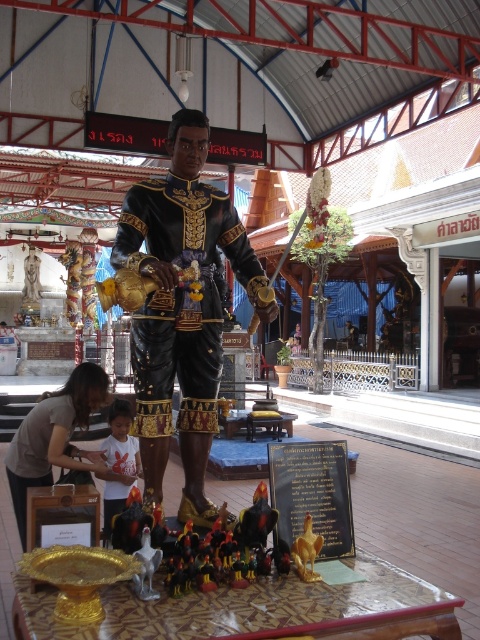
Who is more forward, (99, 465) or (107, 520)?

Point (107, 520)

Who is positioned more to the right, brown fabric shirt at lower left or white cotton shirt at center?

white cotton shirt at center

What are the coordinates of `brown fabric shirt at lower left` in the screenshot? It's located at (55, 436).

Is point (184, 385) positioned after point (309, 525)?

Yes.

Where is `black glossy statue at center`? This screenshot has width=480, height=640. black glossy statue at center is located at coordinates (181, 308).

Between point (214, 211) and point (311, 529), which one is positioned behind?

Point (214, 211)

Find the location of a particular element. black glossy statue at center is located at coordinates (181, 308).

Does point (335, 605) come closer to viewer compared to point (51, 480)?

Yes, it is.

Is gold polished table at center bigger than brown fabric shirt at lower left?

No, gold polished table at center is not bigger than brown fabric shirt at lower left.

Looking at this image, who is more forward, (312, 616) or (38, 412)?

Point (312, 616) is more forward.

The height and width of the screenshot is (640, 480). What are the coordinates of `gold polished table at center` in the screenshot? It's located at (256, 609).